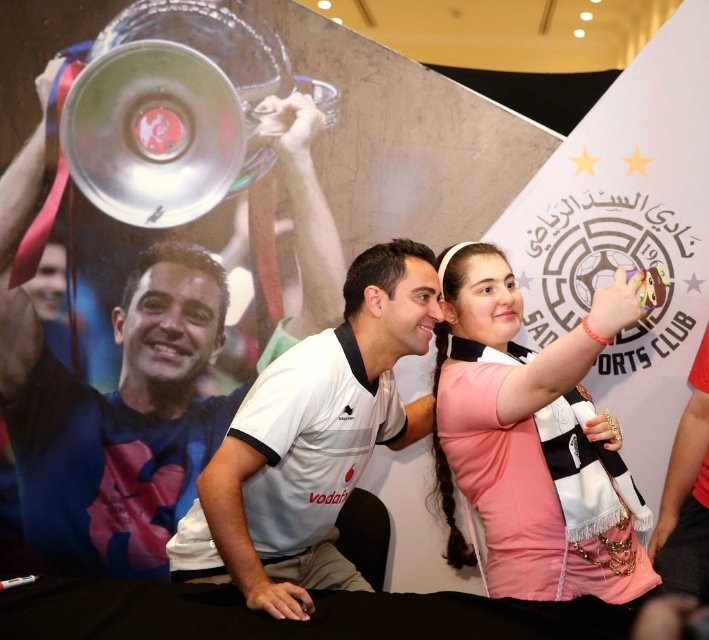
You are a photographer at the event and need to position your camera to capture the metallic trophy at upper left. Given that the camera requires a minimum distance of 2 meters for proper focus, will you be able to achieve focus?

The metallic trophy at upper left and the camera are 2.44 meters apart, which is more than the required 2 meters. Therefore, the camera can achieve proper focus.

You are attending a sports event and see the pink fabric scarf at center and the white matte shirt at center. Which object is positioned higher in the image?

The pink fabric scarf at center is taller than the white matte shirt at center, so the pink fabric scarf at center is positioned higher.